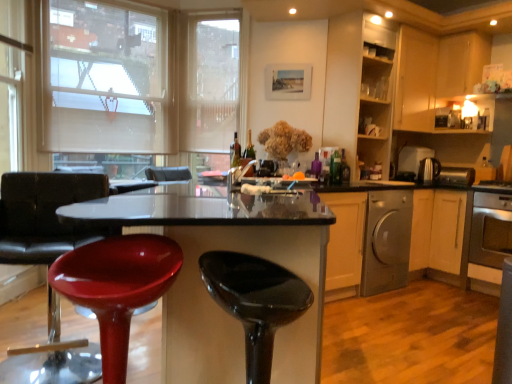
Locate an element on the screen. This screenshot has width=512, height=384. vacant point to the right of glossy plastic table at center is located at coordinates (395, 340).